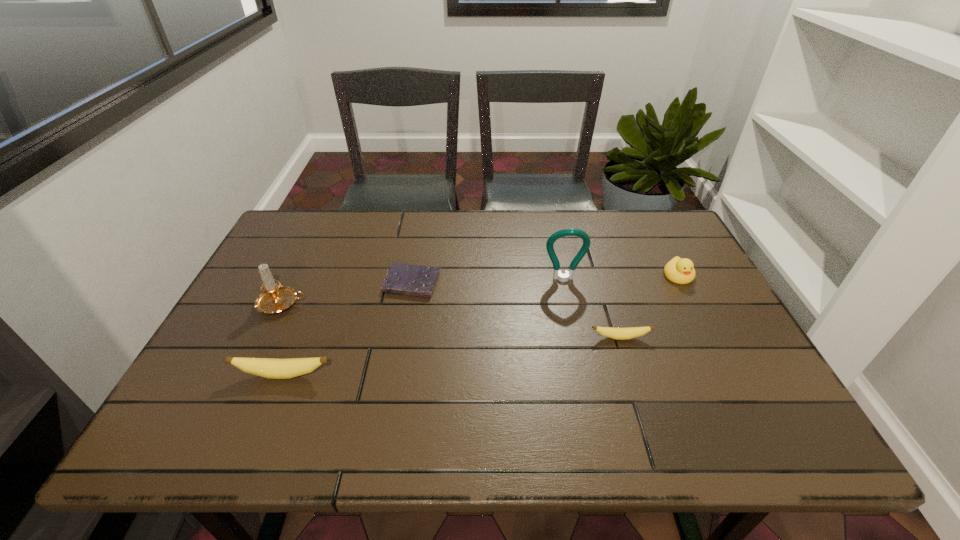
At what (x,y) coordinates should I click in order to perform the action: click on the nearest object. Please return your answer as a coordinate pair (x, y). Looking at the image, I should click on (271, 368).

The height and width of the screenshot is (540, 960). In order to click on the left banana in this screenshot , I will do `click(271, 368)`.

You are a GUI agent. You are given a task and a screenshot of the screen. Output one action in this format:
    pyautogui.click(x=<x>, y=<y>)
    Task: Click on the right banana
    This screenshot has width=960, height=540.
    Given the screenshot: What is the action you would take?
    pyautogui.click(x=628, y=333)

Find the location of a particular element. The width and height of the screenshot is (960, 540). the fifth tallest object is located at coordinates 628,333.

Where is `the tallest object`? This screenshot has height=540, width=960. the tallest object is located at coordinates (583, 235).

At what (x,y) coordinates should I click in order to perform the action: click on candle. Please return your answer as a coordinate pair (x, y). Looking at the image, I should click on (274, 298).

Find the location of a particular element. the shortest object is located at coordinates (403, 279).

At what (x,y) coordinates should I click in order to perform the action: click on the fourth object from right to left. Please return your answer as a coordinate pair (x, y). Looking at the image, I should click on (403, 279).

This screenshot has width=960, height=540. I want to click on duckling, so click(681, 271).

What are the coordinates of `free space located 0.060m on the right of the nearest object` in the screenshot? It's located at [x=360, y=375].